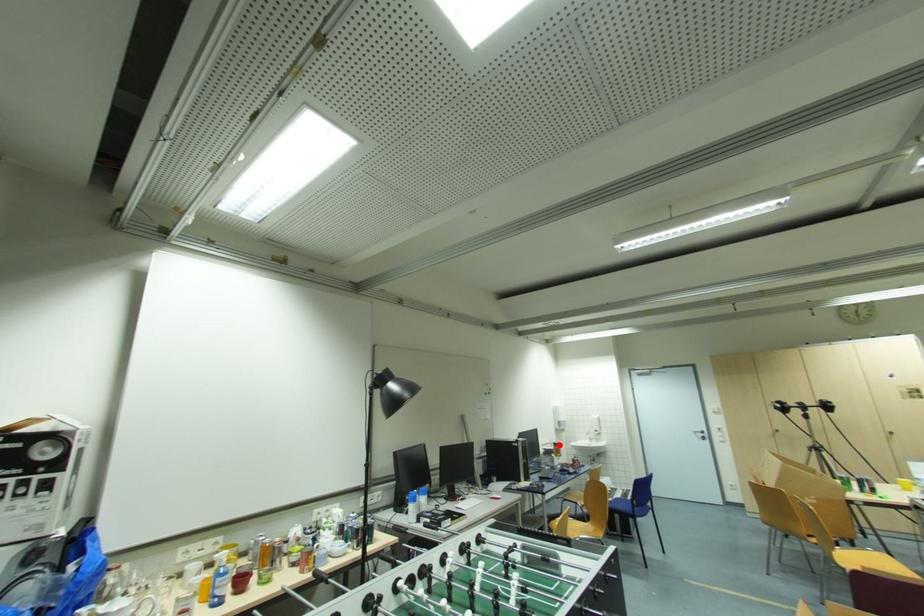
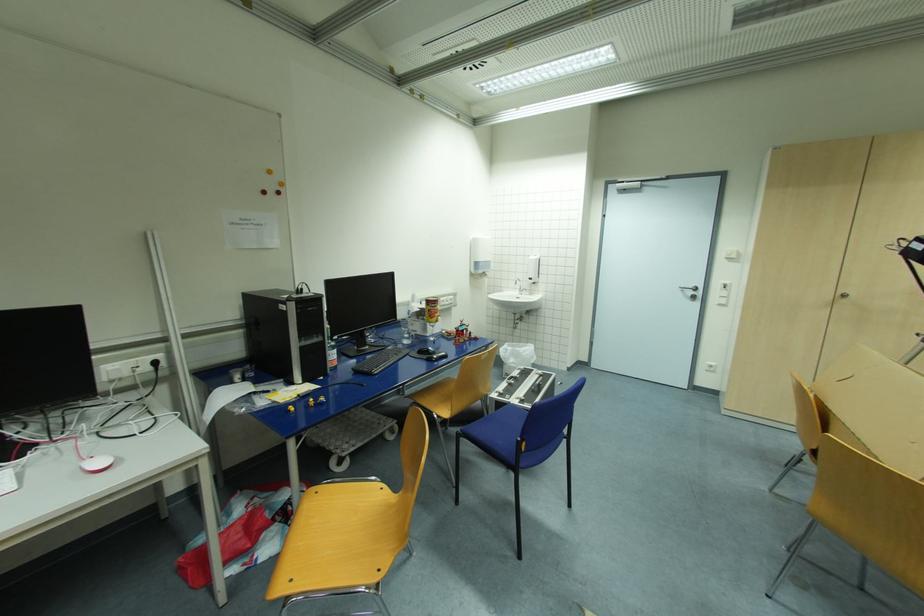
Question: I am providing you with two images of the same scene from different viewpoints. Given a red point in image1, look at the same physical point in image2. Is it:

Choices:
 (A) Closer to the viewpoint
 (B) Farther from the viewpoint

Answer: (A)